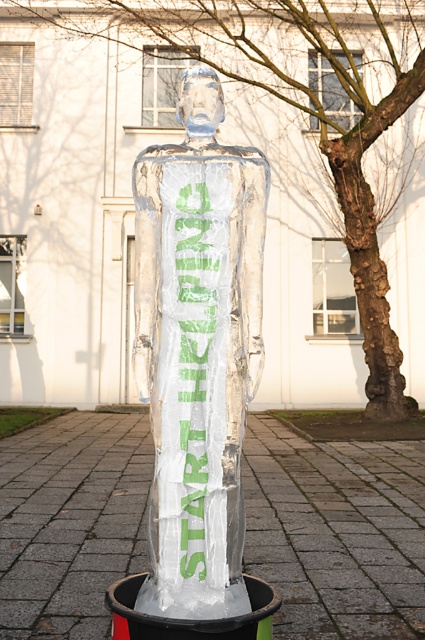
From the picture: What are the coordinates of the bark textured tree at center right?

The bark textured tree at center right is located at coordinates point (221, 140).

You are a hiker who has just arrived at the scene and wants to take a photo of the ice sculpture. To ensure the bark textured tree at center right is visible in the background, where should you position yourself relative to the sculpture?

The bark textured tree at center right is located at point (221,140), so you should position yourself to the right side of the ice sculpture to have the tree in the background.

What are the coordinates of the transparent ice sculpture at center?

The transparent ice sculpture at center is located at coordinates point (336, 532).